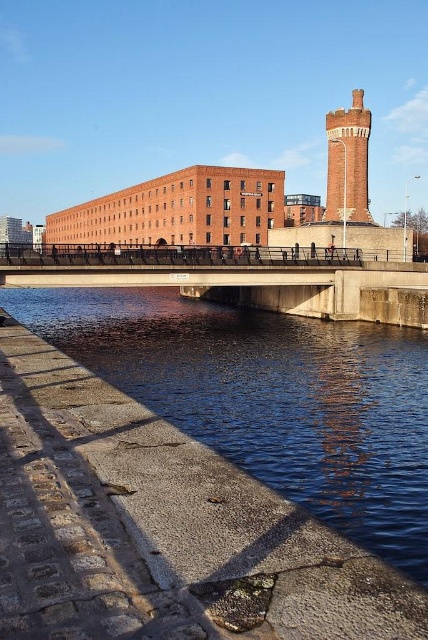
Question: Does blue concrete river at lower left appear on the right side of red brick tower at upper right?

Choices:
 (A) yes
 (B) no

Answer: (B)

Question: Estimate the real-world distances between objects in this image. Which object is farther from the concrete bridge at center?

Choices:
 (A) blue concrete river at lower left
 (B) red brick tower at upper right

Answer: (B)

Question: Is concrete bridge at center bigger than red brick tower at upper right?

Choices:
 (A) yes
 (B) no

Answer: (A)

Question: Where is concrete bridge at center located in relation to red brick tower at upper right in the image?

Choices:
 (A) right
 (B) left

Answer: (B)

Question: Which is farther from the blue concrete river at lower left?

Choices:
 (A) concrete bridge at center
 (B) red brick tower at upper right

Answer: (B)

Question: Which of these objects is positioned farthest from the red brick tower at upper right?

Choices:
 (A) blue concrete river at lower left
 (B) concrete bridge at center

Answer: (A)